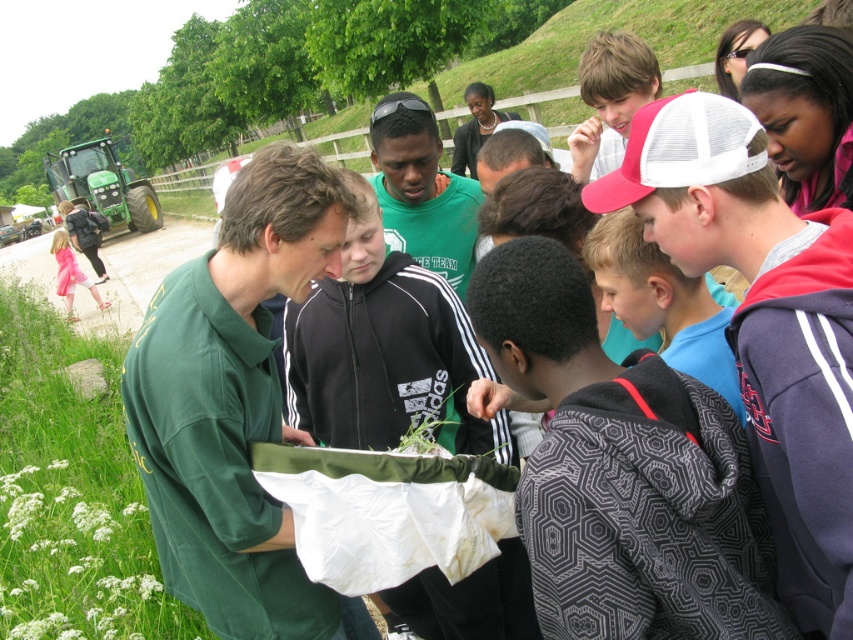
Does white mesh cap at center appear over blue cotton shirt at center?

Incorrect, white mesh cap at center is not positioned above blue cotton shirt at center.

Between point (680, 269) and point (679, 321), which one is positioned behind?

The point (679, 321) is more distant.

You are a GUI agent. You are given a task and a screenshot of the screen. Output one action in this format:
    pyautogui.click(x=<x>, y=<y>)
    Task: Click on the white mesh cap at center
    Image resolution: width=853 pixels, height=640 pixels.
    Given the screenshot: What is the action you would take?
    pyautogui.click(x=763, y=323)

Between point (796, 259) and point (457, 244), which one is positioned in front?

Point (796, 259) is in front.

Who is positioned more to the left, white mesh cap at center or green matte shirt at center?

Positioned to the left is green matte shirt at center.

Who is more distant from viewer, (814, 600) or (386, 189)?

Positioned behind is point (386, 189).

Where is `white mesh cap at center`? This screenshot has width=853, height=640. white mesh cap at center is located at coordinates (763, 323).

From the picture: Who is positioned more to the left, black adidas tracksuit at center or green leafy vegetable at center?

black adidas tracksuit at center

Is black adidas tracksuit at center further to camera compared to green leafy vegetable at center?

Yes, black adidas tracksuit at center is behind green leafy vegetable at center.

Between point (399, 404) and point (415, 445), which one is positioned behind?

Positioned behind is point (399, 404).

Find the location of a particular element. black adidas tracksuit at center is located at coordinates (381, 348).